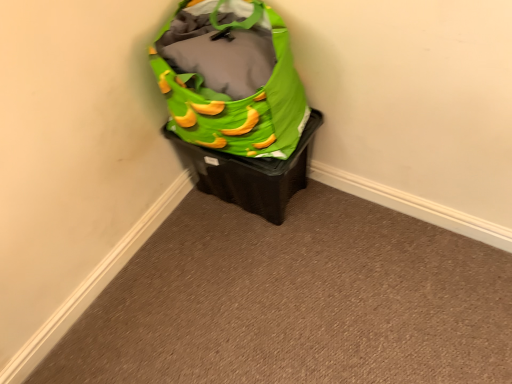
Question: In terms of height, does green fabric bag at upper right look taller or shorter compared to green fabric bag at upper center?

Choices:
 (A) short
 (B) tall

Answer: (B)

Question: Is green fabric bag at upper right to the left or to the right of green fabric bag at upper center in the image?

Choices:
 (A) left
 (B) right

Answer: (A)

Question: Which of these objects is positioned farthest from the green fabric bag at upper right?

Choices:
 (A) green fabric bag at upper center
 (B) green fabric bag at upper right

Answer: (A)

Question: Which object is the closest to the green fabric bag at upper right?

Choices:
 (A) green fabric bag at upper right
 (B) green fabric bag at upper center

Answer: (A)